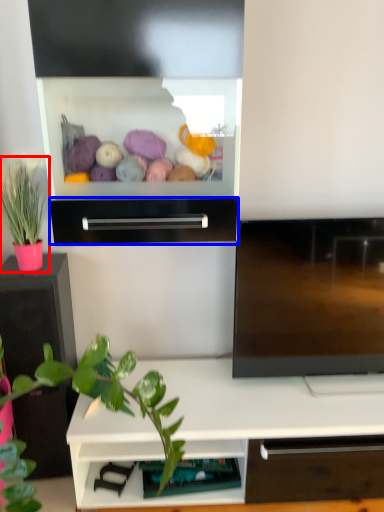
Question: Among these objects, which one is farthest to the camera, houseplant (highlighted by a red box) or drawer (highlighted by a blue box)?

Choices:
 (A) houseplant
 (B) drawer

Answer: (A)